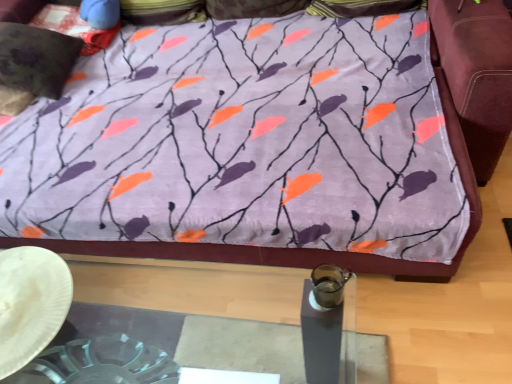
Question: From a real-world perspective, is velvety black pillow at upper left, the first pillow positioned from the bottom, positioned under purple fabric pillow at upper center, which appears as the 3th pillow when ordered from the bottom, based on gravity?

Choices:
 (A) yes
 (B) no

Answer: (A)

Question: Is purple fabric pillow at upper center, which appears as the 3th pillow when ordered from the bottom, surrounded by velvety black pillow at upper left, the first pillow positioned from the bottom?

Choices:
 (A) no
 (B) yes

Answer: (A)

Question: Does velvety black pillow at upper left, which is counted as the 3th pillow, starting from the top, come in front of purple fabric pillow at upper center, the first pillow when ordered from top to bottom?

Choices:
 (A) yes
 (B) no

Answer: (A)

Question: Can you confirm if velvety black pillow at upper left, which is counted as the 3th pillow, starting from the top, is wider than purple fabric pillow at upper center, the first pillow when ordered from top to bottom?

Choices:
 (A) yes
 (B) no

Answer: (A)

Question: Considering the relative positions of velvety black pillow at upper left, which is counted as the 3th pillow, starting from the top, and purple fabric pillow at upper center, the first pillow when ordered from top to bottom, in the image provided, is velvety black pillow at upper left, which is counted as the 3th pillow, starting from the top, behind purple fabric pillow at upper center, the first pillow when ordered from top to bottom,?

Choices:
 (A) yes
 (B) no

Answer: (B)

Question: Considering the positions of velvety dark brown pillow at upper left, which appears as the second pillow when viewed from the top, and purple fabric pillow at upper center, which appears as the 3th pillow when ordered from the bottom, in the image, is velvety dark brown pillow at upper left, which appears as the second pillow when viewed from the top, wider or thinner than purple fabric pillow at upper center, which appears as the 3th pillow when ordered from the bottom,?

Choices:
 (A) thin
 (B) wide

Answer: (B)

Question: Relative to purple fabric pillow at upper center, the first pillow when ordered from top to bottom, is velvety dark brown pillow at upper left, which appears as the second pillow when viewed from the top, in front or behind?

Choices:
 (A) behind
 (B) front

Answer: (B)

Question: From a real-world perspective, is velvety dark brown pillow at upper left, marked as the 2th pillow in a bottom-to-top arrangement, positioned above or below purple fabric pillow at upper center, the first pillow when ordered from top to bottom?

Choices:
 (A) below
 (B) above

Answer: (A)

Question: Choose the correct answer: Is velvety dark brown pillow at upper left, which appears as the second pillow when viewed from the top, inside purple fabric pillow at upper center, the first pillow when ordered from top to bottom, or outside it?

Choices:
 (A) inside
 (B) outside

Answer: (B)

Question: Relative to white paper plate at lower left, is velvety black pillow at upper left, which is counted as the 3th pillow, starting from the top, in front or behind?

Choices:
 (A) behind
 (B) front

Answer: (A)

Question: Considering the positions of velvety black pillow at upper left, the first pillow positioned from the bottom, and white paper plate at lower left in the image, is velvety black pillow at upper left, the first pillow positioned from the bottom, wider or thinner than white paper plate at lower left?

Choices:
 (A) thin
 (B) wide

Answer: (B)

Question: Which is correct: velvety black pillow at upper left, which is counted as the 3th pillow, starting from the top, is inside white paper plate at lower left, or outside of it?

Choices:
 (A) outside
 (B) inside

Answer: (A)

Question: From the image's perspective, is velvety black pillow at upper left, the first pillow positioned from the bottom, positioned above or below white paper plate at lower left?

Choices:
 (A) above
 (B) below

Answer: (A)

Question: Considering the positions of white paper plate at lower left and purple fabric bedspread at upper center in the image, is white paper plate at lower left wider or thinner than purple fabric bedspread at upper center?

Choices:
 (A) wide
 (B) thin

Answer: (B)

Question: From a real-world perspective, is white paper plate at lower left positioned above or below purple fabric bedspread at upper center?

Choices:
 (A) below
 (B) above

Answer: (B)